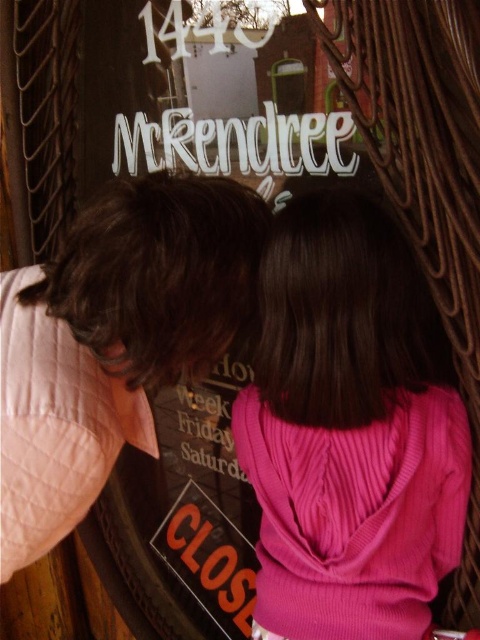
You are a delivery person holding a package that requires a 12 inch clearance to pass through a narrow hallway. You need to navigate between the pink ribbed sweater at center and the pink sweater at center. Can you fit through the space between them?

The distance between the pink ribbed sweater at center and the pink sweater at center is 10.17 inches, which is less than the required 12 inch clearance. Therefore, you cannot fit through the space between them.

You are an observer standing in front of the glass door. You notice two pink sweaters in the scene. Which one is taller, the pink ribbed sweater at center or the pink sweater at center?

The pink ribbed sweater at center has a greater height compared to the pink sweater at center.

You are a fashion designer observing two people near a glass door. You notice the pink ribbed sweater at center and the pink sweater at center. Which one is positioned to the right?

The pink ribbed sweater at center is to the right of pink sweater at center.